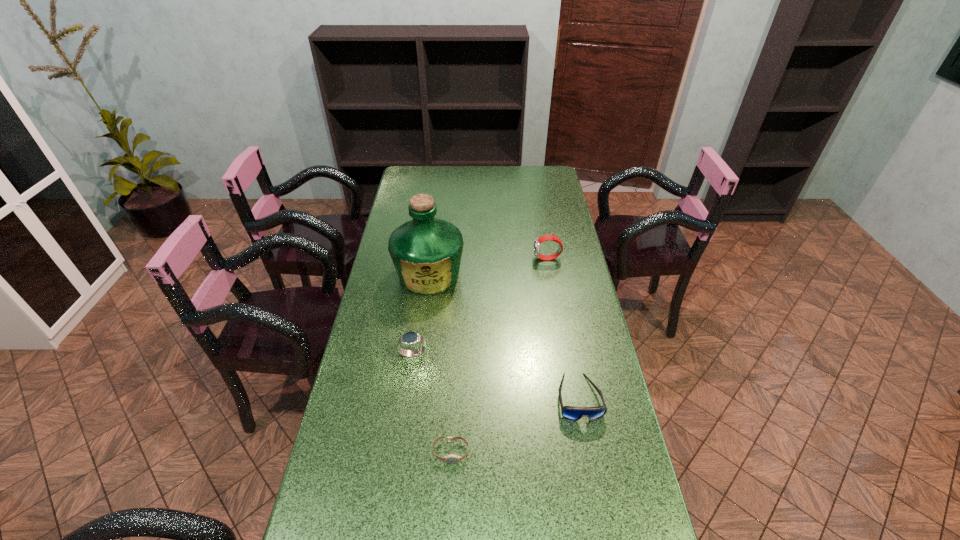
You are a GUI agent. You are given a task and a screenshot of the screen. Output one action in this format:
    pyautogui.click(x=<x>, y=<y>)
    Task: Click on the free space located 0.290m on the face of the rightmost watch
    
    Given the screenshot: What is the action you would take?
    pyautogui.click(x=456, y=259)

Locate an element on the screen. Image resolution: width=960 pixels, height=540 pixels. vacant position located 0.400m on the face of the rightmost watch is located at coordinates (426, 259).

Where is `vacant point located 0.230m on the face of the rightmost watch`? Image resolution: width=960 pixels, height=540 pixels. vacant point located 0.230m on the face of the rightmost watch is located at coordinates (472, 259).

I want to click on vacant point located 0.110m on the left of the third shortest object, so [362, 354].

The height and width of the screenshot is (540, 960). I want to click on vacant region located on the front-facing side of the fourth tallest object, so [x=598, y=501].

You are a GUI agent. You are given a task and a screenshot of the screen. Output one action in this format:
    pyautogui.click(x=<x>, y=<y>)
    Task: Click on the vacant area situated on the face of the shortest watch
    The image size is (960, 540).
    Given the screenshot: What is the action you would take?
    pyautogui.click(x=449, y=485)

Find the location of a particular element. Image resolution: width=960 pixels, height=540 pixels. liquor situated at the left edge is located at coordinates pyautogui.click(x=426, y=252).

Image resolution: width=960 pixels, height=540 pixels. In order to click on watch that is positioned at the left edge in this screenshot , I will do `click(410, 338)`.

Image resolution: width=960 pixels, height=540 pixels. What are the coordinates of `watch that is at the right edge` in the screenshot? It's located at (539, 240).

The width and height of the screenshot is (960, 540). I want to click on sunglasses located in the right edge section of the desktop, so click(x=573, y=413).